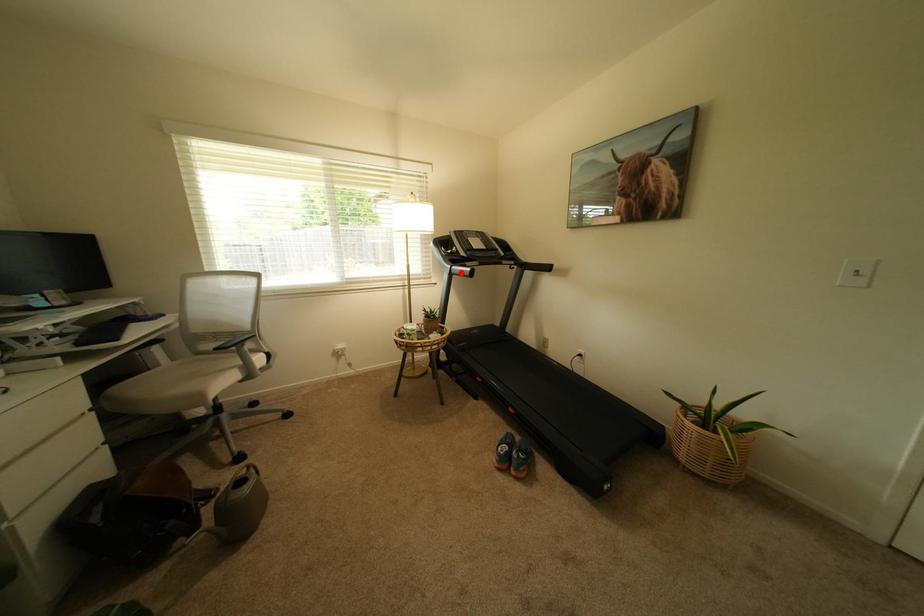
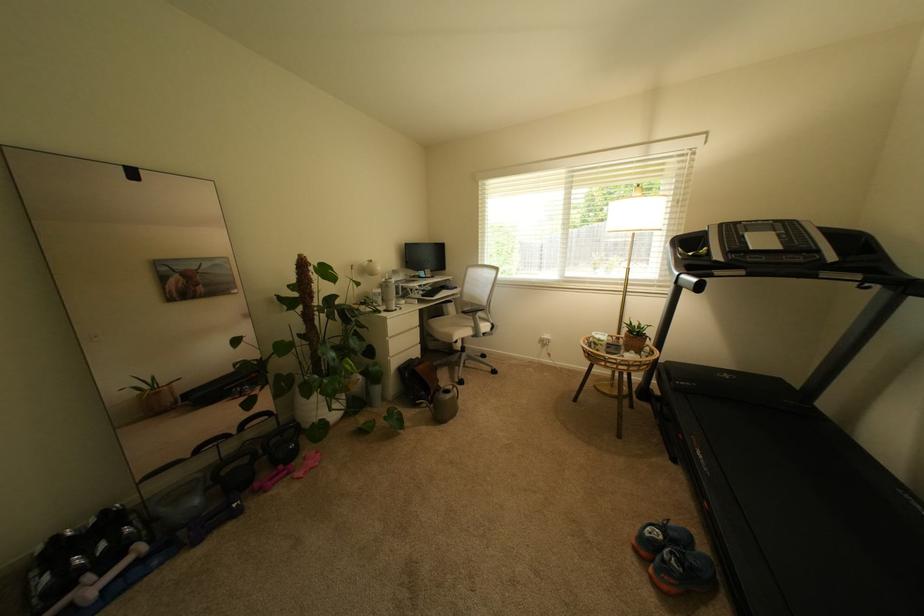
The point at the highlighted location is marked in the first image. Where is the corresponding point in the second image?

(688, 283)